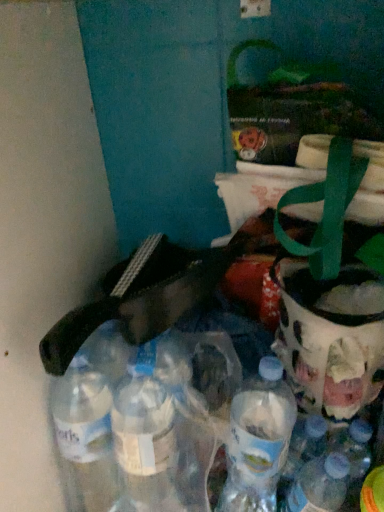
Question: Is translucent plastic bottle at lower right, which ranks as the 2th bottle in left-to-right order, completely or partially inside clear plastic bottles at lower left, the 2th bottle positioned from the right?

Choices:
 (A) yes
 (B) no

Answer: (B)

Question: Does clear plastic bottles at lower left, the first bottle from the left, have a greater height compared to translucent plastic bottle at lower right, the first bottle when ordered from right to left?

Choices:
 (A) yes
 (B) no

Answer: (A)

Question: Is clear plastic bottles at lower left, the 2th bottle positioned from the right, to the left of translucent plastic bottle at lower right, which ranks as the 2th bottle in left-to-right order, from the viewer's perspective?

Choices:
 (A) no
 (B) yes

Answer: (B)

Question: Does clear plastic bottles at lower left, the 2th bottle positioned from the right, have a lesser width compared to translucent plastic bottle at lower right, the first bottle when ordered from right to left?

Choices:
 (A) no
 (B) yes

Answer: (A)

Question: From a real-world perspective, is clear plastic bottles at lower left, the first bottle from the left, located higher than translucent plastic bottle at lower right, the first bottle when ordered from right to left?

Choices:
 (A) yes
 (B) no

Answer: (A)

Question: Based on their sizes in the image, would you say clear plastic bottles at lower left, the 2th bottle positioned from the right, is bigger or smaller than translucent plastic bottle at lower right, the first bottle when ordered from right to left?

Choices:
 (A) big
 (B) small

Answer: (A)

Question: Do you think clear plastic bottles at lower left, the 2th bottle positioned from the right, is within translucent plastic bottle at lower right, which ranks as the 2th bottle in left-to-right order, or outside of it?

Choices:
 (A) inside
 (B) outside

Answer: (B)

Question: Is point (188, 360) closer or farther from the camera than point (319, 471)?

Choices:
 (A) closer
 (B) farther

Answer: (B)

Question: Considering their positions, is clear plastic bottles at lower left, the 2th bottle positioned from the right, located in front of or behind translucent plastic bottle at lower right, which ranks as the 2th bottle in left-to-right order?

Choices:
 (A) front
 (B) behind

Answer: (A)

Question: Looking at their shapes, would you say clear plastic bottles at lower left, the 2th bottle positioned from the right, is wider or thinner than translucent glass jar at right?

Choices:
 (A) wide
 (B) thin

Answer: (A)

Question: Is point (104, 504) closer or farther from the camera than point (367, 329)?

Choices:
 (A) farther
 (B) closer

Answer: (A)

Question: Is clear plastic bottles at lower left, the 2th bottle positioned from the right, taller or shorter than translucent glass jar at right?

Choices:
 (A) tall
 (B) short

Answer: (A)

Question: From the image's perspective, is clear plastic bottles at lower left, the first bottle from the left, above or below translucent glass jar at right?

Choices:
 (A) above
 (B) below

Answer: (B)

Question: Relative to translucent glass jar at right, is translucent plastic bottle at lower right, which ranks as the 2th bottle in left-to-right order, in front or behind?

Choices:
 (A) behind
 (B) front

Answer: (B)

Question: Is point (301, 467) closer or farther from the camera than point (340, 389)?

Choices:
 (A) farther
 (B) closer

Answer: (A)